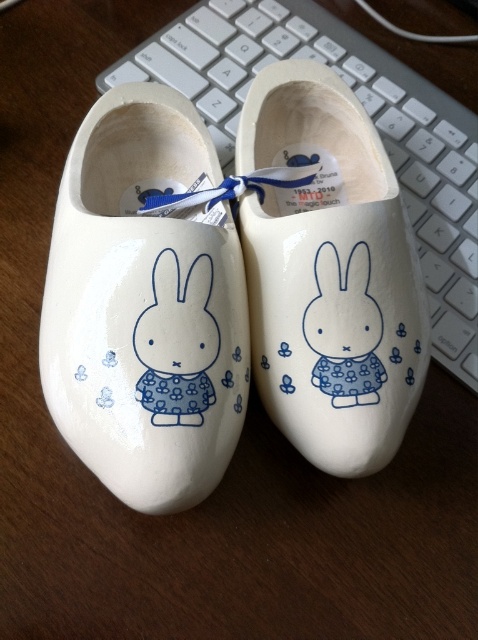
You are standing in front of the wooden clogs and want to place a small sticker on the point that is closer to you. Which point should you choose between point [368,416] and point [315,10]?

Point [368,416] is closer to the camera than point [315,10], so you should choose point [368,416] to place the sticker.

You are organizing a small shelf where you need to stack items vertically. You have the white glossy wooden shoe at left and the white plastic keyboard at upper center. Which item should you place at the bottom to ensure stability?

You should place the white glossy wooden shoe at left at the bottom because it has a lesser height compared to the white plastic keyboard at upper center, making it more stable as a base.

You are organizing a small desk space and need to place the white glossy wooden shoe at left and the white plastic keyboard at upper center side by side. Given their sizes, will the total width of both items exceed the desk space available, which is 1.2 meters wide?

The white glossy wooden shoe at left is narrower than the white plastic keyboard at upper center. However, without knowing the exact width of either item, it is impossible to determine if their combined width exceeds 1.2 meters. Additional measurements are needed.